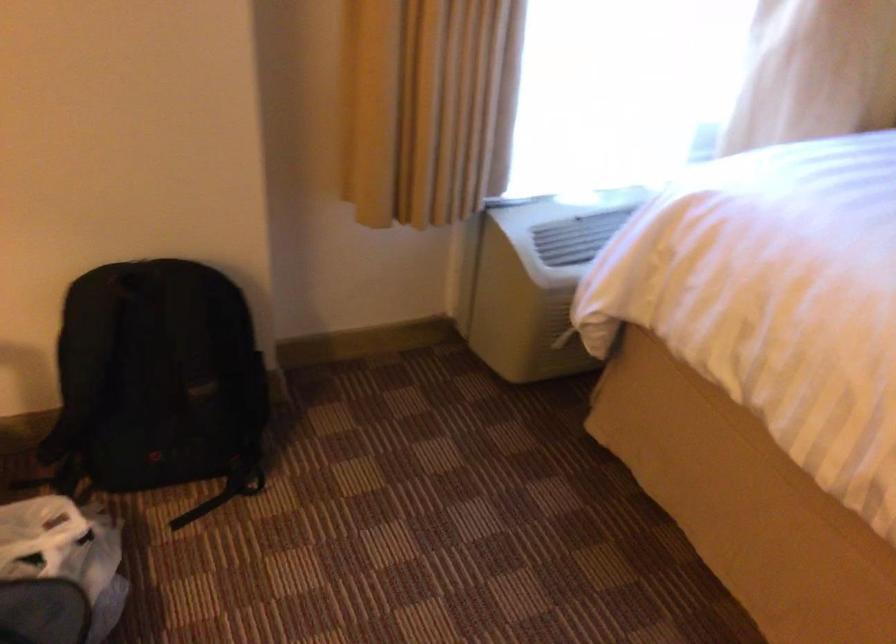
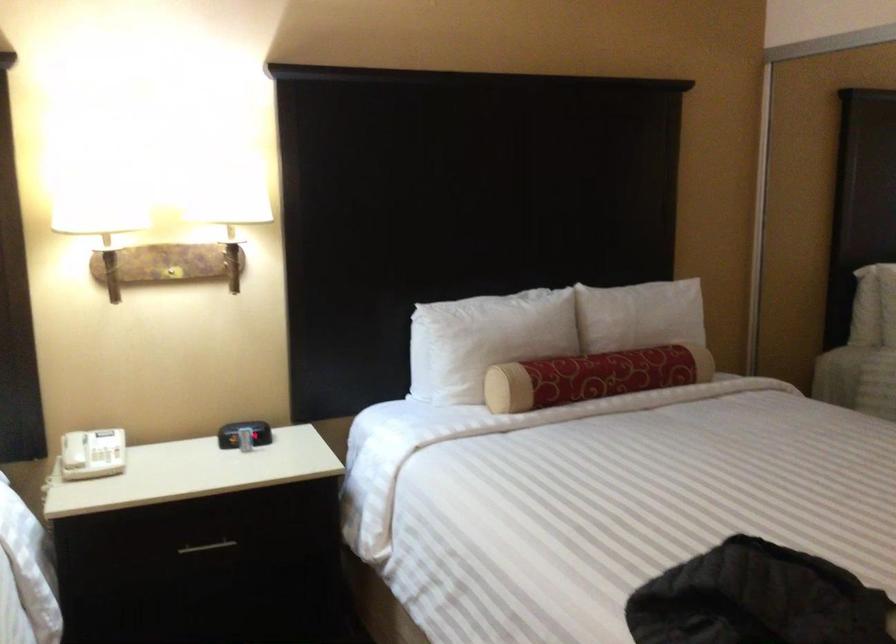
Question: The camera is either moving clockwise (left) or counter-clockwise (right) around the object. The first image is from the beginning of the video and the second image is from the end. Is the camera moving left or right when shooting the video?

Choices:
 (A) Left
 (B) Right

Answer: (A)